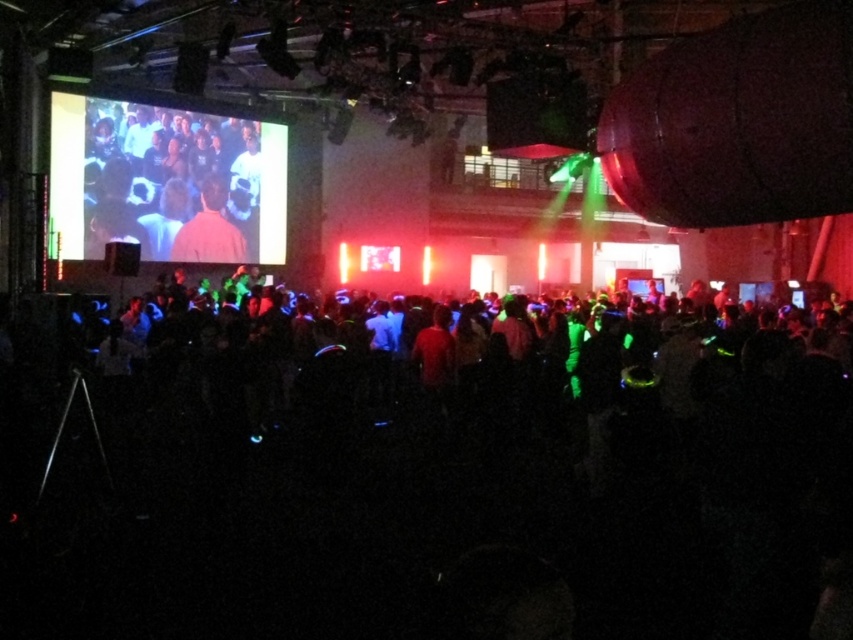
You are a photographer at the event and need to capture a clear photo of the neon green glowing crowd at center. Your camera has a minimum focus distance of 2 meters. Can you take the photo without moving closer?

The neon green glowing crowd at center and camera are 2.12 meters apart from each other. Since the minimum focus distance is 2 meters, the camera can focus on the neon green glowing crowd at center as the distance is sufficient.

Looking at this image, you are at the event and want to find the neon green glowing crowd at center. According to the coordinates provided, where exactly should you look?

You should look at point (437, 490) to find the neon green glowing crowd at center.

Looking at this image, you are at the event and want to take a photo of the neon green glowing crowd at center and the matte black shirt at upper left. Which object should you focus on first if you want to capture both in the same frame without moving the camera?

The neon green glowing crowd at center is thinner than the matte black shirt at upper left, so you should focus on the matte black shirt at upper left first because it is wider and will require less adjustment to include both in the frame.